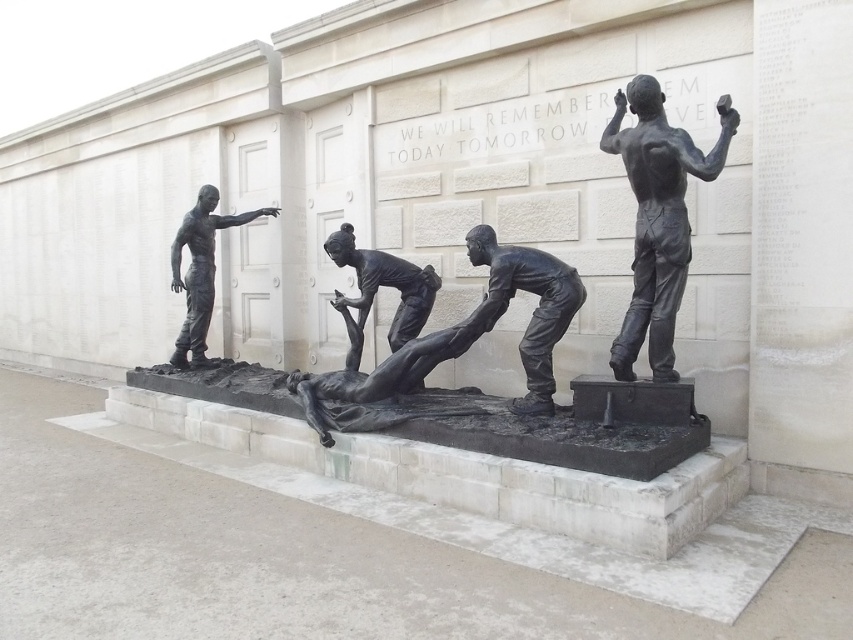
Question: Which of the following is the closest to the observer?

Choices:
 (A) bronze statue at left
 (B) bronze statue of person at center

Answer: (B)

Question: Observing the image, what is the correct spatial positioning of bronze statue at upper right in reference to bronze statue of person at center?

Choices:
 (A) right
 (B) left

Answer: (A)

Question: Among these objects, which one is farthest from the camera?

Choices:
 (A) bronze statue of person at center
 (B) bronze figure at center
 (C) bronze statue at upper right

Answer: (A)

Question: Which object appears farthest from the camera in this image?

Choices:
 (A) bronze statue at upper right
 (B) bronze statue at left
 (C) bronze figure at center

Answer: (B)

Question: Is bronze statue at upper right above bronze figure at center?

Choices:
 (A) yes
 (B) no

Answer: (A)

Question: Is bronze statue at upper right wider than bronze statue of person at center?

Choices:
 (A) no
 (B) yes

Answer: (A)